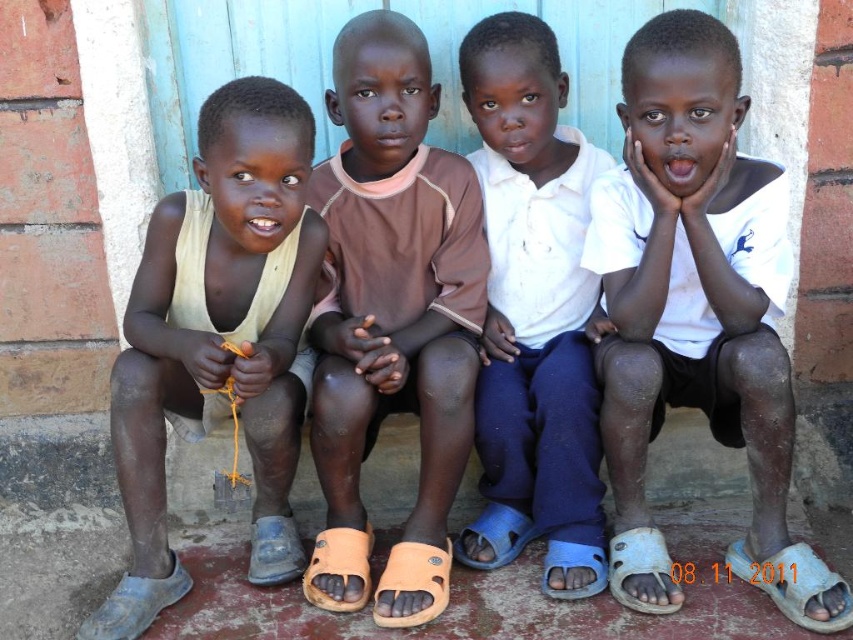
Question: Which of these objects is positioned closest to the blue rubber sandal at lower right?

Choices:
 (A) white cotton shirt at center
 (B) gray fabric sandal at lower left

Answer: (A)

Question: Does white matte shirt at center have a greater width compared to matte yellow tank top at left?

Choices:
 (A) no
 (B) yes

Answer: (B)

Question: Which of the following is the farthest from the observer?

Choices:
 (A) white plastic sandal at lower right
 (B) orange rubber sandal at lower center

Answer: (B)

Question: Does white cotton shirt at center appear on the left side of gray fabric sandal at lower left?

Choices:
 (A) yes
 (B) no

Answer: (B)

Question: In this image, where is white matte shirt at center located relative to white cotton shirt at center?

Choices:
 (A) above
 (B) below

Answer: (B)

Question: Among these points, which one is farthest from the camera?

Choices:
 (A) (433, 611)
 (B) (471, 156)
 (C) (618, 572)

Answer: (B)